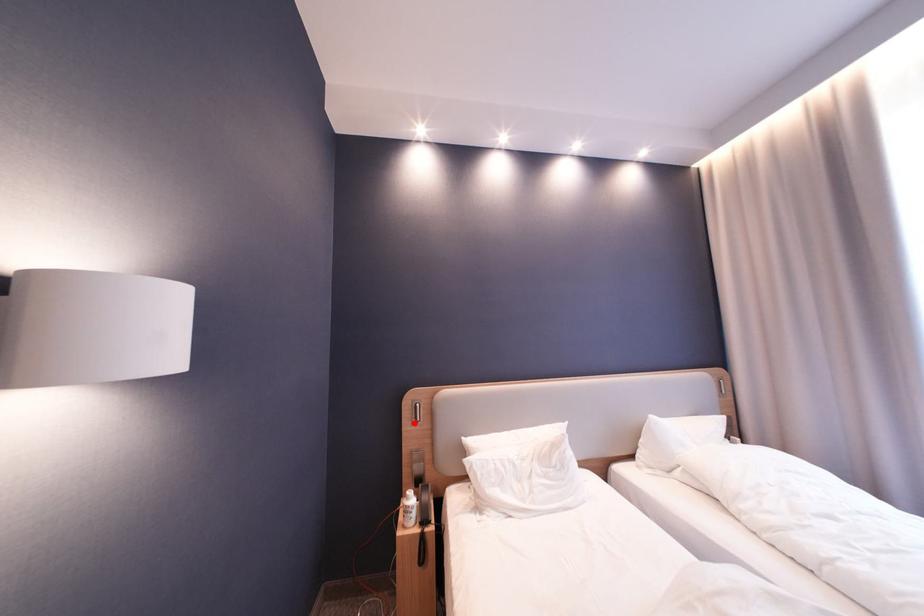
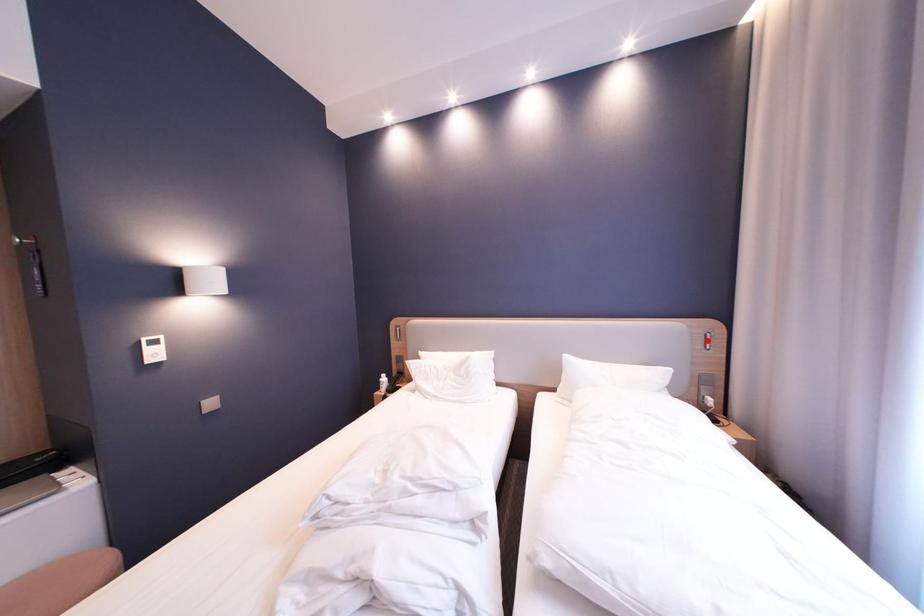
I am providing you with two images of the same scene from different viewpoints. A red point is marked on the first image and another point is marked on the second image. Do the highlighted points in image1 and image2 indicate the same real-world spot?

No